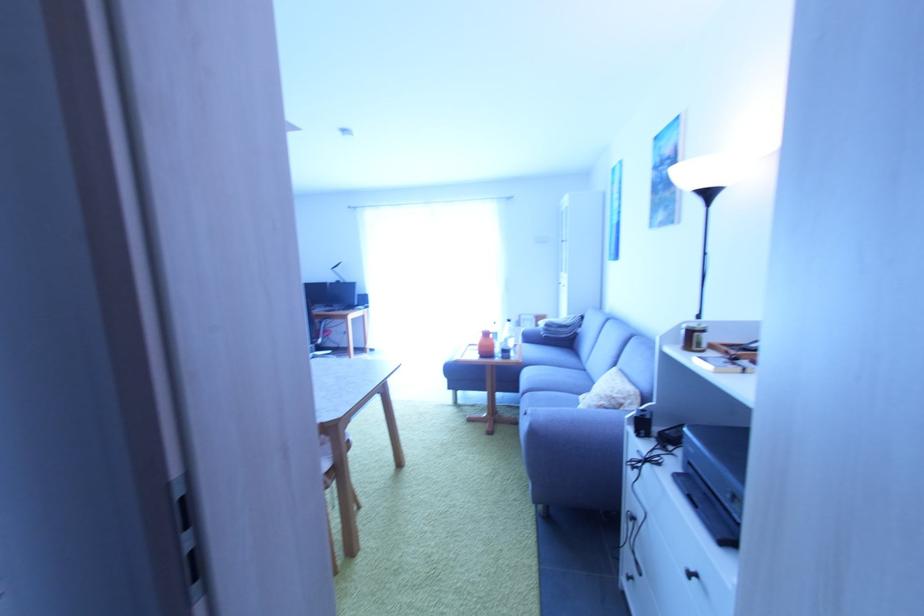
Where is `black drawer handle`? The height and width of the screenshot is (616, 924). black drawer handle is located at coordinates (693, 576).